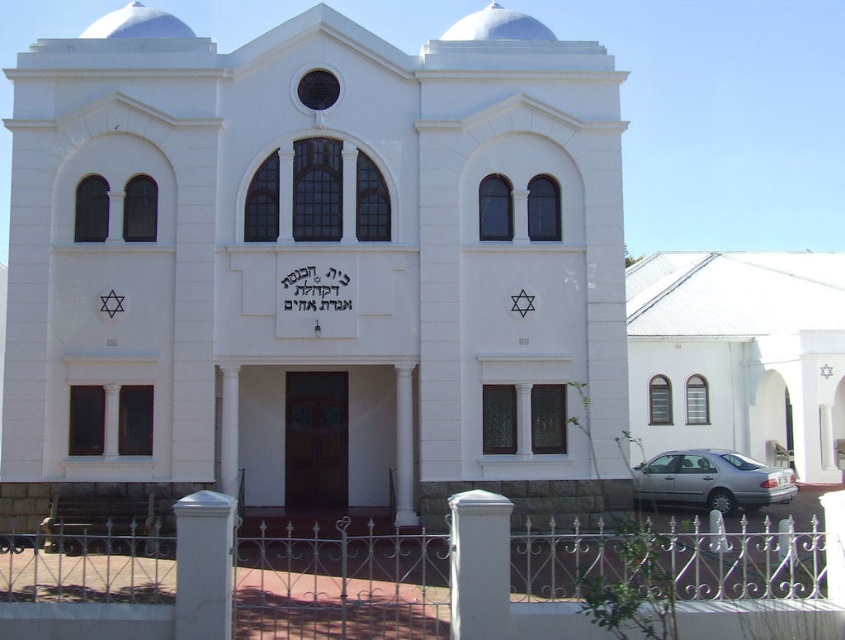
Question: Which object is the closest to the white stone church at center?

Choices:
 (A) white wrought iron fence at center
 (B) silver metallic car at lower right
 (C) white smooth chapel at lower right

Answer: (A)

Question: Is white wrought iron fence at center to the right of white smooth chapel at lower right from the viewer's perspective?

Choices:
 (A) yes
 (B) no

Answer: (B)

Question: Which point is closer to the camera taking this photo?

Choices:
 (A) (58, 248)
 (B) (788, 461)
 (C) (724, 561)
 (D) (658, 484)

Answer: (C)

Question: Does white stone church at center have a smaller size compared to white smooth chapel at lower right?

Choices:
 (A) yes
 (B) no

Answer: (A)

Question: Does white stone church at center appear on the left side of silver metallic car at lower right?

Choices:
 (A) yes
 (B) no

Answer: (A)

Question: Which of the following is the farthest from the observer?

Choices:
 (A) white smooth chapel at lower right
 (B) silver metallic car at lower right

Answer: (B)